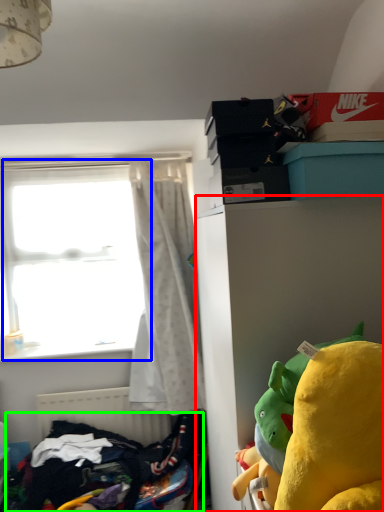
Question: Which object is positioned farthest from cabinetry (highlighted by a red box)? Select from window (highlighted by a blue box) and clothing (highlighted by a green box).

Choices:
 (A) window
 (B) clothing

Answer: (A)